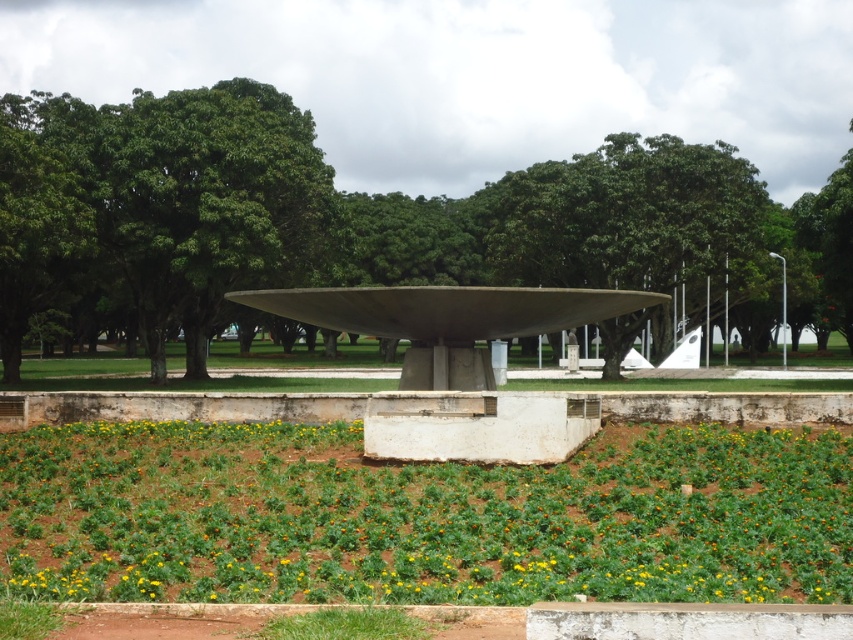
You are standing in the garden area and want to take a photo of both the green leafy plant at lower center and the green leafy tree at upper left. Which direction should you face to have both in your camera frame?

You should face towards the right side of the green leafy tree at upper left to include both the green leafy plant at lower center and the green leafy tree at upper left in your camera frame since the green leafy plant at lower center is positioned to the right of the green leafy tree at upper left.

You are planning to plant a new tree in the garden area near the sculpture. You have two options for placement. One spot is where the green leafy tree at center is currently located, and the other is where the green leafy tree at upper left is. Which location would allow the new tree to grow taller without overshadowing the sculpture?

The green leafy tree at center has a larger size compared to the green leafy tree at upper left. Therefore, planting the new tree at the location of the green leafy tree at upper left would allow it to grow without overshadowing the sculpture, as it is smaller and less likely to block the view.